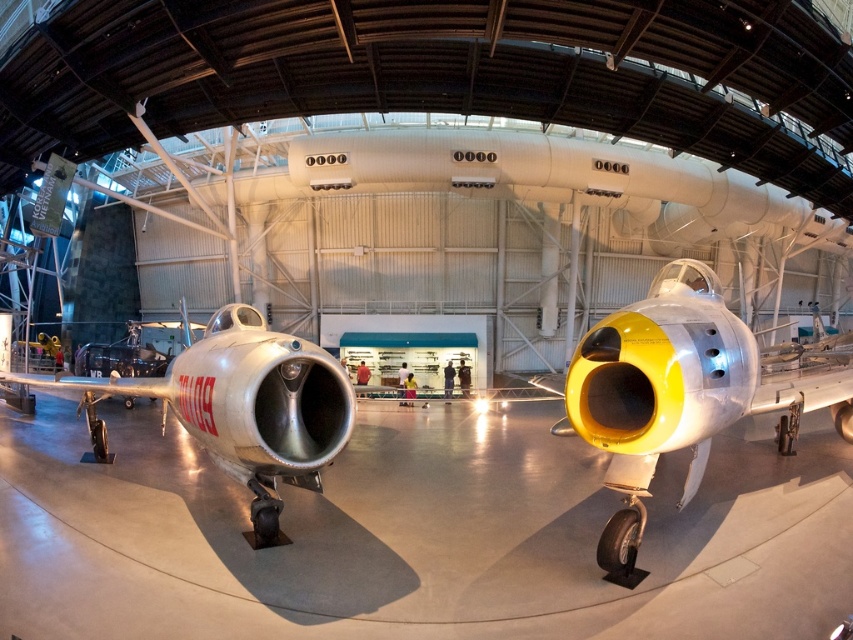
You are standing in the hangar and want to reach the point at coordinates point (834,371). If you are currently 10 feet away from the aircraft on the left, how much farther do you need to walk to reach the point?

The point (834,371) is 24.89 feet away from the viewer. Since you are currently 10 feet away from the aircraft on the left, you need to walk an additional 14.89 feet to reach the point.

You are a museum guide explaining the layout of the hangar. You need to describe the position of the yellow matte jet engine at center relative to the silver metallic airplane at center. What do you say?

The yellow matte jet engine at center is positioned above the silver metallic airplane at center.

You are a museum guide standing in the hangar and want to point out the yellow matte jet engine at center and the silver metallic airplane at center to a visitor. Which object should you mention first if you want to describe them in order from closest to farthest?

The yellow matte jet engine at center is closer to the viewer than the silver metallic airplane at center, so you should mention the yellow matte jet engine at center first.